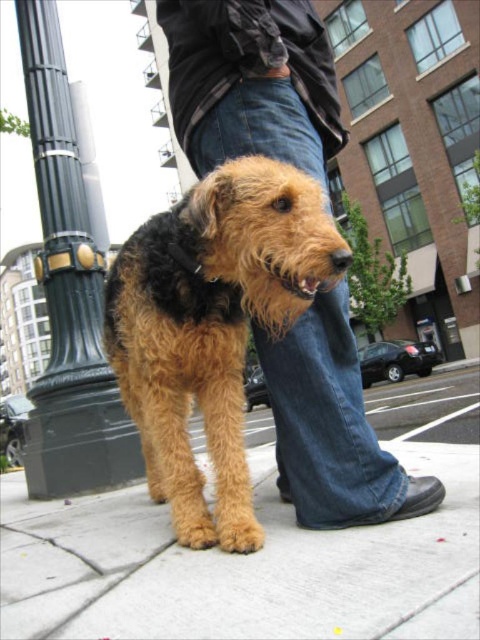
Question: Among these points, which one is farthest from the camera?

Choices:
 (A) (192, 497)
 (B) (344, 321)
 (C) (56, 531)
 (D) (55, 371)

Answer: (D)

Question: Which point is farther to the camera?

Choices:
 (A) fuzzy brown dog at center
 (B) brown concrete pavement at lower center

Answer: (A)

Question: Does jeans at center have a larger size compared to black metal pole at left?

Choices:
 (A) yes
 (B) no

Answer: (A)

Question: Among these points, which one is nearest to the camera?

Choices:
 (A) (454, 435)
 (B) (204, 376)

Answer: (B)

Question: In this image, where is fuzzy brown dog at center located relative to black metal pole at left?

Choices:
 (A) left
 (B) right

Answer: (B)

Question: Can you confirm if fuzzy brown dog at center is positioned above black metal pole at left?

Choices:
 (A) yes
 (B) no

Answer: (B)